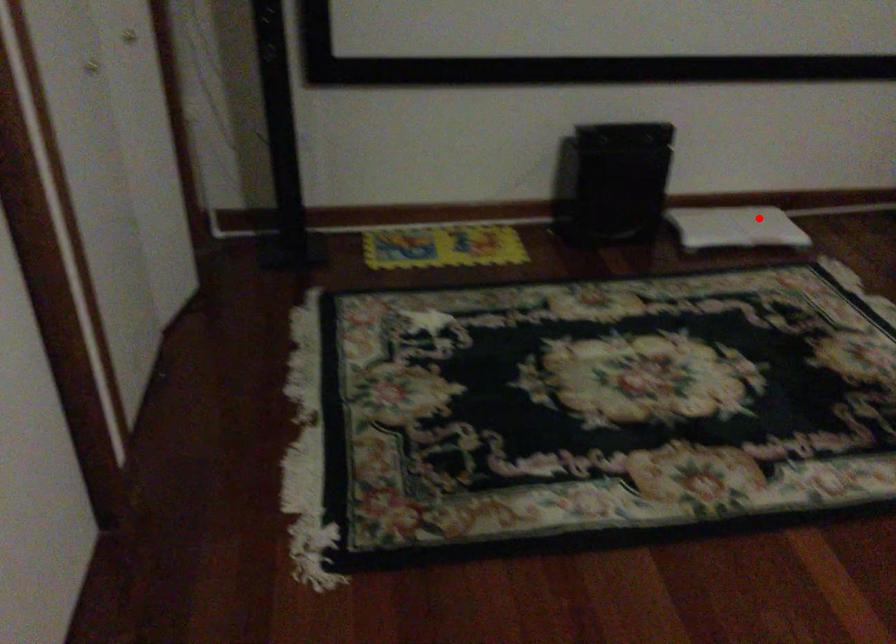
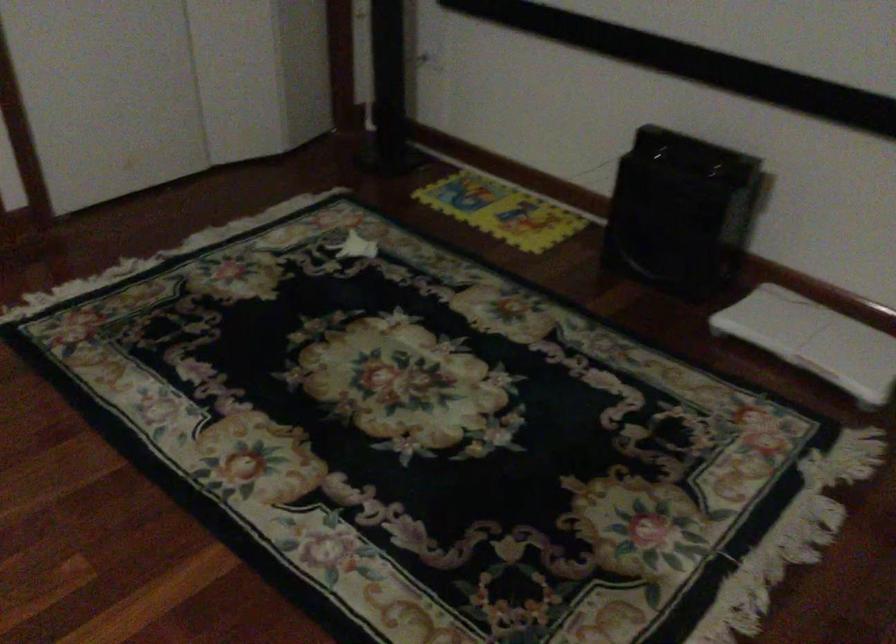
Find the pixel in the second image that matches the highlighted location in the first image.

(814, 339)